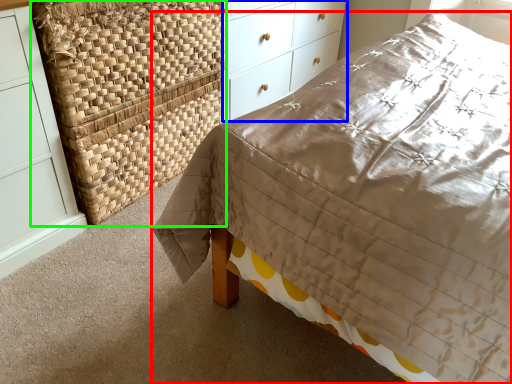
Question: Based on their relative distances, which object is nearer to bed (highlighted by a red box)? Choose from chest of drawers (highlighted by a blue box) and basket (highlighted by a green box).

Choices:
 (A) chest of drawers
 (B) basket

Answer: (B)